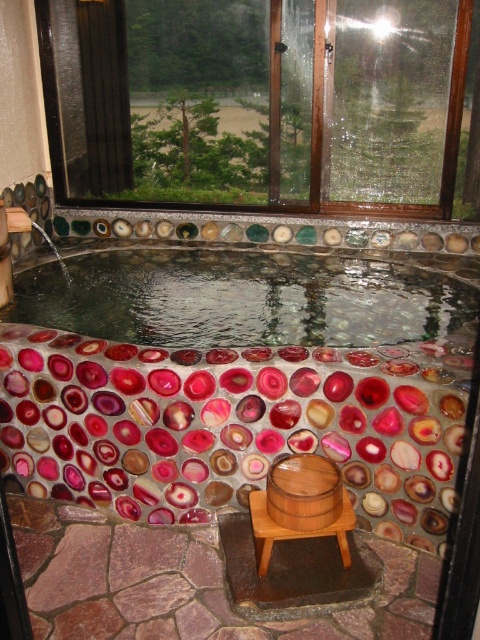
Which of these two, polished stone bath at center or transparent glass window at upper center, stands shorter?

Standing shorter between the two is transparent glass window at upper center.

Can you confirm if polished stone bath at center is wider than transparent glass window at upper center?

Correct, the width of polished stone bath at center exceeds that of transparent glass window at upper center.

This screenshot has width=480, height=640. Describe the element at coordinates (237, 381) in the screenshot. I see `polished stone bath at center` at that location.

Find the location of `polished stone bath at center`. polished stone bath at center is located at coordinates (237, 381).

Describe the element at coordinates (256, 102) in the screenshot. I see `transparent glass window at upper center` at that location.

Does point (333, 204) lie behind point (279, 464)?

Yes, point (333, 204) is farther from viewer.

The image size is (480, 640). Identify the location of transparent glass window at upper center. (256, 102).

Between transparent glass window at upper center and wooden at lower center, which one has less height?

Standing shorter between the two is wooden at lower center.

Who is taller, transparent glass window at upper center or wooden at lower center?

Standing taller between the two is transparent glass window at upper center.

This screenshot has width=480, height=640. Find the location of `transparent glass window at upper center`. transparent glass window at upper center is located at coordinates (256, 102).

The height and width of the screenshot is (640, 480). Find the location of `transparent glass window at upper center`. transparent glass window at upper center is located at coordinates (256, 102).